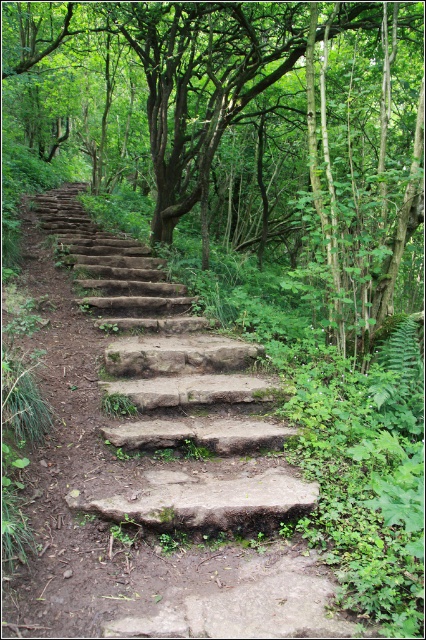
Who is positioned more to the right, green leafy tree at center or brown stone stairs at center?

Positioned to the right is brown stone stairs at center.

In order to click on green leafy tree at center in this screenshot , I will do `click(238, 124)`.